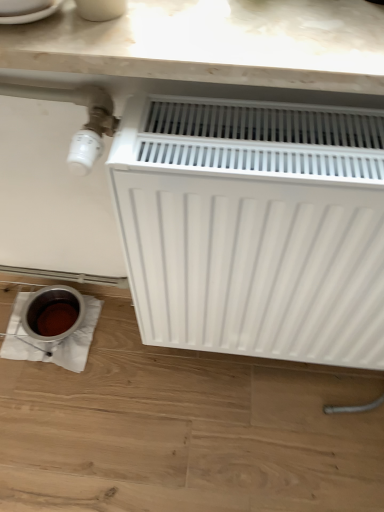
I want to click on empty space that is ontop of white marble countertop at upper center (from a real-world perspective), so click(x=183, y=26).